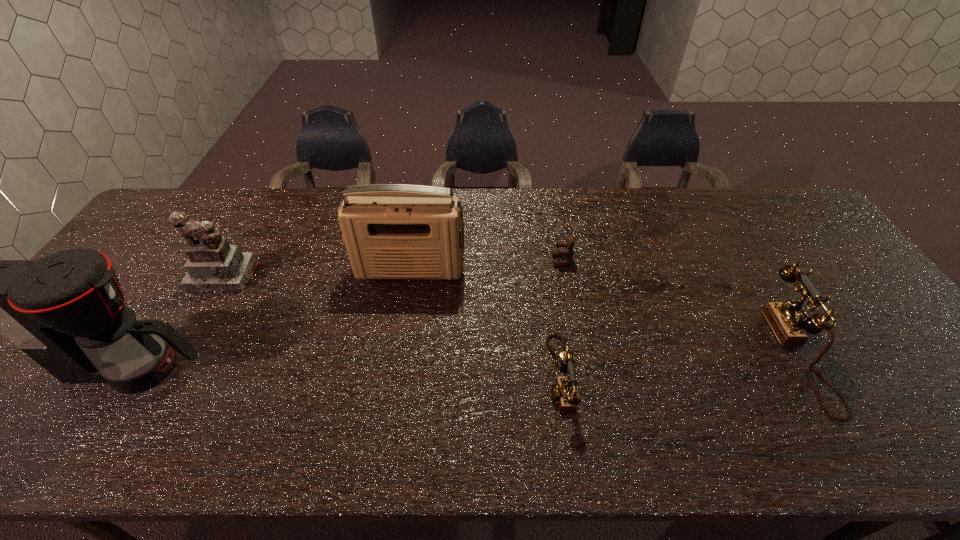
With all telephones evenly spaced, where should an extra telephone be placed on the left to continue the pattern? Please point out a vacant space. Please provide its 2D coordinates. Your answer should be formatted as a tuple, i.e. [(x, y)], where the tuple contains the x and y coordinates of a point satisfying the conditions above.

[(298, 399)]